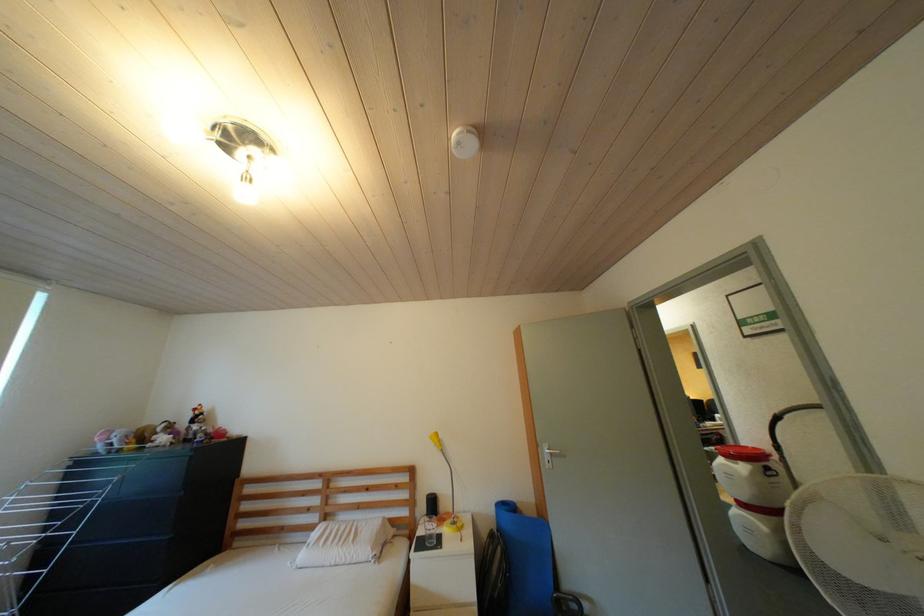
This screenshot has width=924, height=616. I want to click on white bed pillow, so click(345, 543).